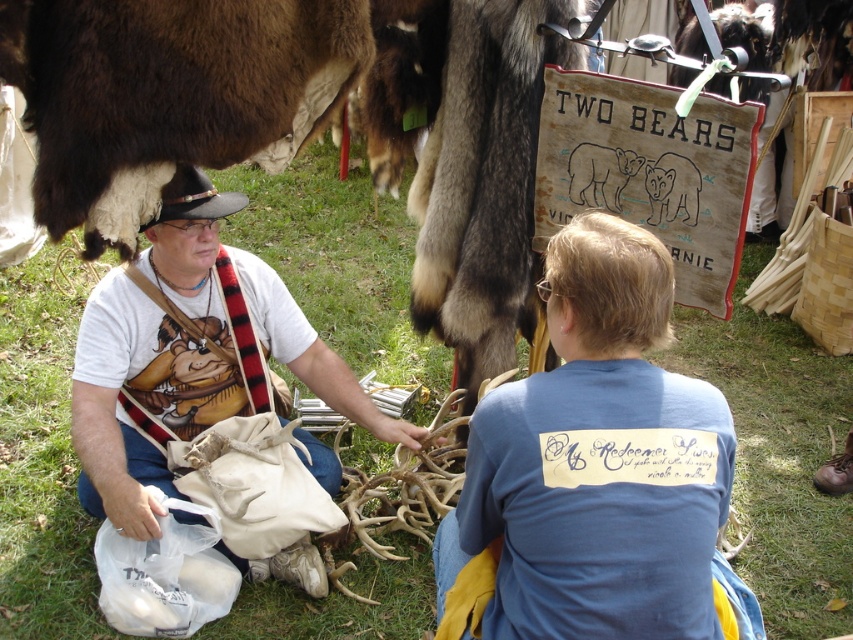
You are organizing a costume check for the historical reenactment. You need to ensure that the blue cotton shirt at center and the black leather cowboy hat at upper left are visible to all attendees. Given their sizes, which item might require a higher vantage point to fully see from the back of the crowd?

The blue cotton shirt at center has a larger width than the black leather cowboy hat at upper left, so the blue cotton shirt at center may require a higher vantage point to ensure full visibility from the back of the crowd due to its greater size.

You are planning to place a small decorative rock between the green grass at center and the black leather cowboy hat at upper left. What is the minimum distance you need to cover to place the rock exactly halfway between them?

The minimum distance you need to cover is 3.365 feet because the total distance between the green grass at center and the black leather cowboy hat at upper left is 6.73 feet, so half of that distance is 3.365 feet.